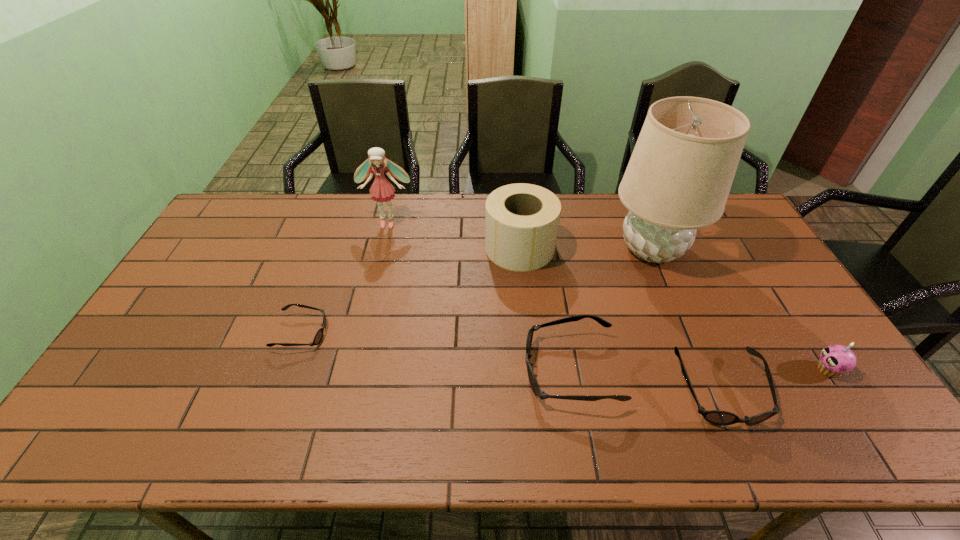
If equal spacing is the goal by inserting an additional sunglasses among them, please point out a vacant space for this new sunglasses. Please provide its 2D coordinates. Your answer should be formatted as a tuple, i.e. [(x, y)], where the tuple contains the x and y coordinates of a point satisfying the conditions above.

[(431, 350)]